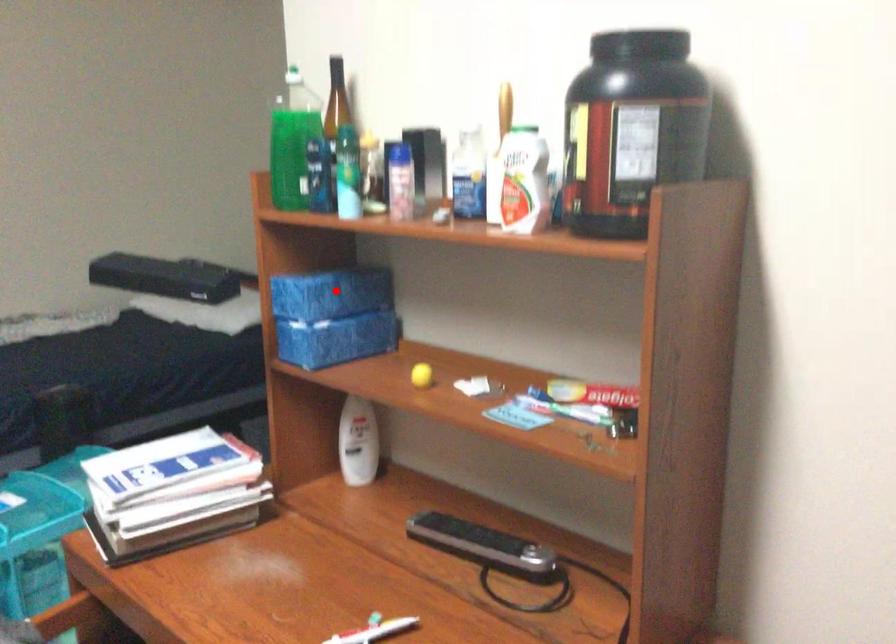
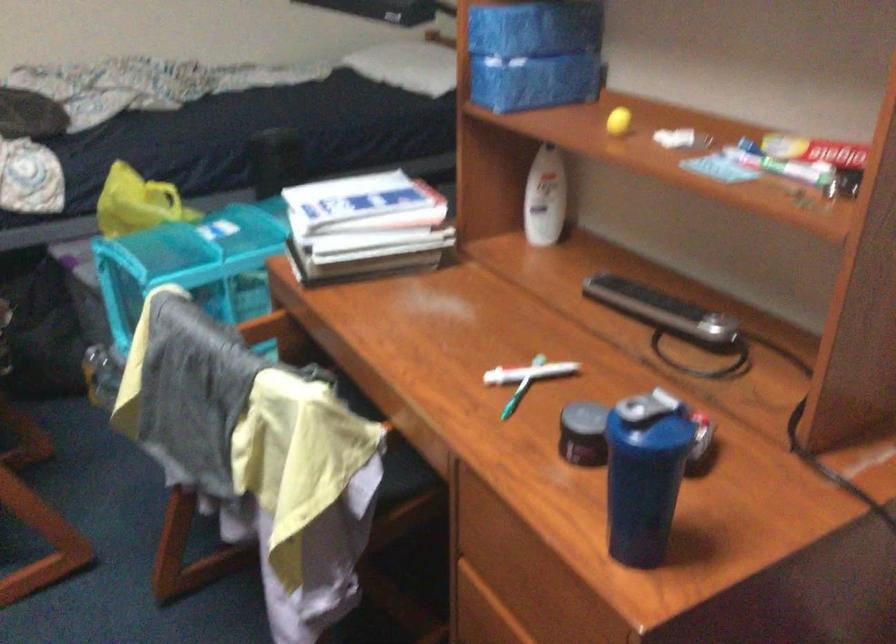
Question: I am providing you with two images of the same scene from different viewpoints. A red point is marked on the first image. At the location where the point appears in image 1, is it still visible in image 2?

Choices:
 (A) Yes
 (B) No

Answer: (A)